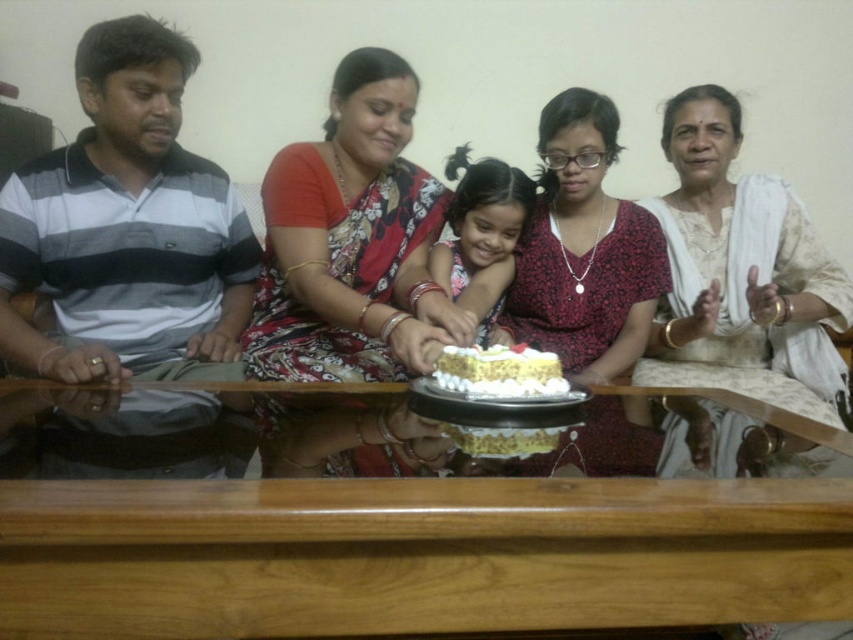
Question: Which point is closer to the camera taking this photo?

Choices:
 (A) (413, 572)
 (B) (575, 273)

Answer: (A)

Question: Which of the following is the closest to the observer?

Choices:
 (A) (279, 296)
 (B) (140, 488)

Answer: (B)

Question: Can you confirm if white textured saree at right is wider than white cream cake at center?

Choices:
 (A) no
 (B) yes

Answer: (B)

Question: Is wooden table at center below smooth white cake at center?

Choices:
 (A) yes
 (B) no

Answer: (A)

Question: From the image, what is the correct spatial relationship of floral fabric dress at center in relation to white cream cake at center?

Choices:
 (A) above
 (B) below

Answer: (A)

Question: Which point is farther from the camera taking this photo?

Choices:
 (A) (170, 493)
 (B) (532, 384)
 (C) (657, 472)

Answer: (B)